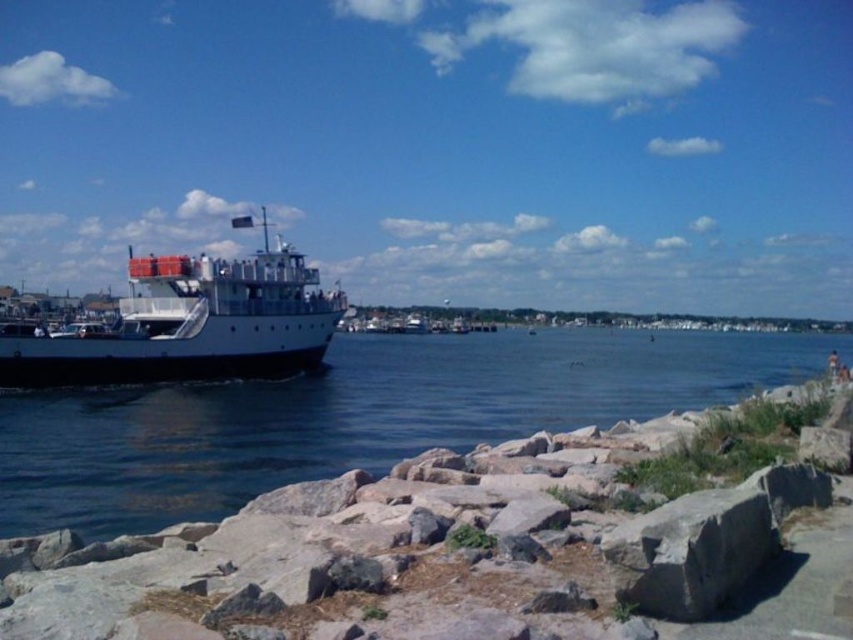
Who is taller, blue water at left or white matte boat at left?

Standing taller between the two is white matte boat at left.

Who is lower down, blue water at left or white matte boat at left?

Positioned lower is blue water at left.

Where is `blue water at left`? blue water at left is located at coordinates (355, 416).